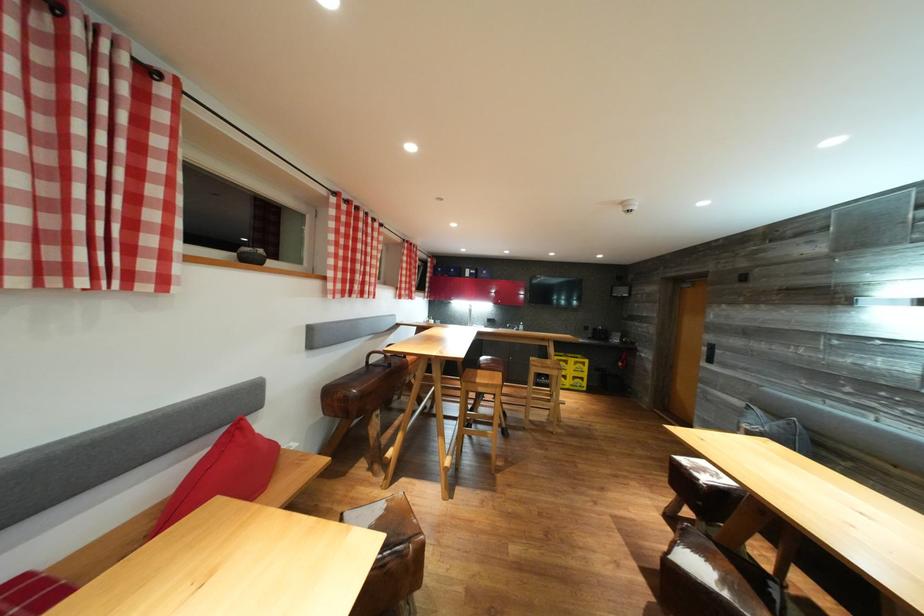
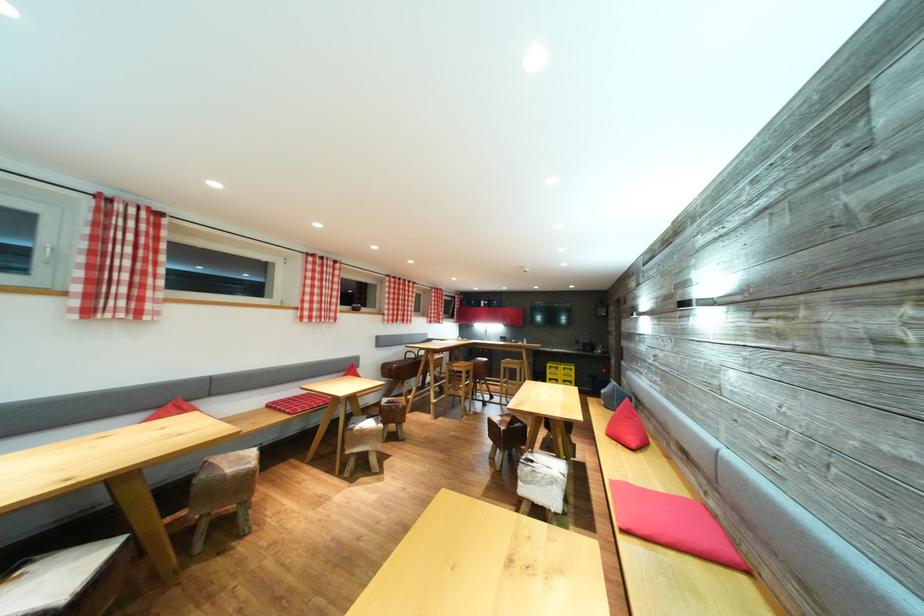
Which direction would the cameraman need to move to produce the second image?

The cameraman walked toward right, backward.